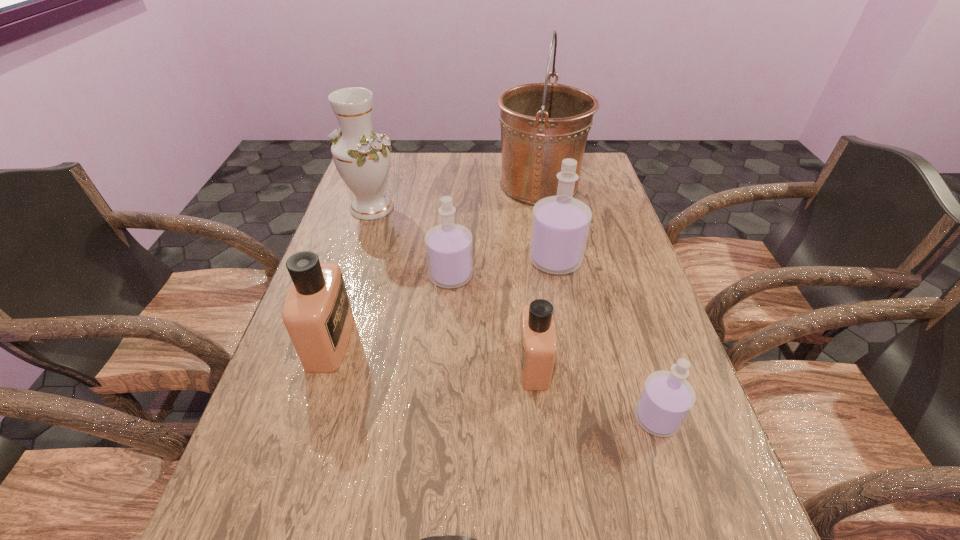
This screenshot has height=540, width=960. Identify the location of vacant region between the vase and the tallest object. (456, 197).

This screenshot has height=540, width=960. What are the coordinates of `vacant area between the smallest purple perfume and the second purple perfume from left to right` in the screenshot? It's located at (606, 339).

Identify the location of vacant point located between the bucket and the leftmost purple perfume. The width and height of the screenshot is (960, 540). (495, 231).

Identify the location of object that stands as the fifth closest to the watch. point(560,224).

Identify the location of object that is the fourth nearest to the right beige perfume. (441, 539).

Locate which perfume ranks second in proximity to the tallest object. Please provide its 2D coordinates. Your answer should be formatted as a tuple, i.e. [(x, y)], where the tuple contains the x and y coordinates of a point satisfying the conditions above.

[(449, 251)]

Locate which perfume is the second closest to the smaller beige perfume. Please provide its 2D coordinates. Your answer should be formatted as a tuple, i.e. [(x, y)], where the tuple contains the x and y coordinates of a point satisfying the conditions above.

[(449, 251)]

This screenshot has height=540, width=960. I want to click on purple perfume that is the third closest one to the vase, so click(x=666, y=399).

I want to click on the second closest purple perfume to the vase, so click(x=560, y=224).

Where is `vacant space that satisfies the following two spatial constraints: 1. on the front side of the nearest perfume; 2. on the left side of the second purple perfume from left to right`? This screenshot has height=540, width=960. vacant space that satisfies the following two spatial constraints: 1. on the front side of the nearest perfume; 2. on the left side of the second purple perfume from left to right is located at coordinates (586, 418).